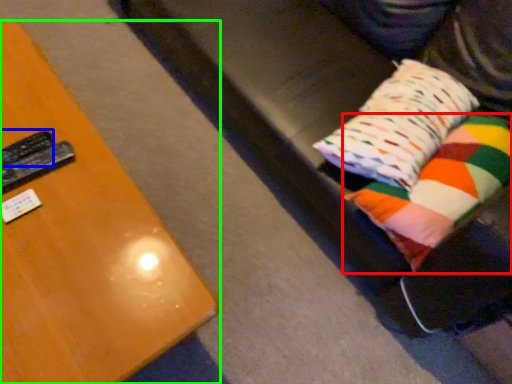
Question: Which object is the farthest from pillow (highlighted by a red box)? Choose among these: remote (highlighted by a blue box) or furniture (highlighted by a green box).

Choices:
 (A) remote
 (B) furniture

Answer: (A)